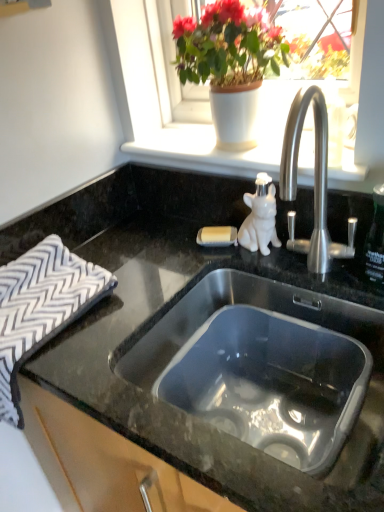
Describe the element at coordinates (172, 306) in the screenshot. I see `black granite countertop at center` at that location.

At what (x,y) coordinates should I click in order to perform the action: click on black granite countertop at center. Please return your answer as a coordinate pair (x, y). This screenshot has width=384, height=512. Looking at the image, I should click on (172, 306).

Find the location of `stainless steel sink at center`. stainless steel sink at center is located at coordinates (261, 362).

What are the coordinates of `white matte window sill at upper center` in the screenshot? It's located at (204, 152).

Considering the points (30, 268) and (269, 290), which point is behind, point (30, 268) or point (269, 290)?

The point (269, 290) is more distant.

From the image's perspective, would you say white zigzag-patterned cloth at left is shown under stainless steel sink at center?

No.

From a real-world perspective, which object rests below the other?

stainless steel sink at center is physically lower.

Which of these two, white zigzag-patterned cloth at left or black granite countertop at center, is bigger?

black granite countertop at center is bigger.

Is white zigzag-patterned cloth at left to the right of black granite countertop at center from the viewer's perspective?

No, white zigzag-patterned cloth at left is not to the right of black granite countertop at center.

Is there a large distance between matte white pot at upper center and stainless steel sink at center?

No.

Who is more distant, matte white pot at upper center or stainless steel sink at center?

matte white pot at upper center is more distant.

From the image's perspective, which is below, matte white pot at upper center or stainless steel sink at center?

stainless steel sink at center is shown below in the image.

Would you say stainless steel sink at center is part of matte white pot at upper center's contents?

→ No, matte white pot at upper center does not contain stainless steel sink at center.

From the picture: Is stainless steel sink at center oriented towards white matte window sill at upper center?

No, stainless steel sink at center is not facing towards white matte window sill at upper center.

Can you confirm if stainless steel sink at center is smaller than white matte window sill at upper center?

Actually, stainless steel sink at center might be larger than white matte window sill at upper center.

Is stainless steel sink at center positioned in front of white matte window sill at upper center?

Yes, stainless steel sink at center is closer to the viewer.

Where is `sink below the white matte window sill at upper center (from a real-world perspective)`? The image size is (384, 512). sink below the white matte window sill at upper center (from a real-world perspective) is located at coordinates (261, 362).

Considering the relative sizes of white matte window sill at upper center and black granite countertop at center in the image provided, is white matte window sill at upper center bigger than black granite countertop at center?

No.

Which object is positioned more to the right, white matte window sill at upper center or black granite countertop at center?

From the viewer's perspective, white matte window sill at upper center appears more on the right side.

Does white matte window sill at upper center come in front of black granite countertop at center?

That is False.

Looking at this image, is stainless steel sink at center thinner than matte white pot at upper center?

No, stainless steel sink at center is not thinner than matte white pot at upper center.

Consider the image. From the image's perspective, does stainless steel sink at center appear higher than matte white pot at upper center?

No, from the image's perspective, stainless steel sink at center is not over matte white pot at upper center.

Considering the sizes of objects stainless steel sink at center and matte white pot at upper center in the image provided, who is taller, stainless steel sink at center or matte white pot at upper center?

matte white pot at upper center.

Is the depth of black granite countertop at center less than that of matte white pot at upper center?

Yes, it is.

Is black granite countertop at center looking in the opposite direction of matte white pot at upper center?

No, black granite countertop at center's orientation is not away from matte white pot at upper center.

Is point (213, 443) closer or farther from the camera than point (176, 58)?

Point (213, 443) is closer to the camera than point (176, 58).

Is the surface of black granite countertop at center in direct contact with matte white pot at upper center?

They are not placed beside each other.

Where is `sink below the white zigzag-patterned cloth at left (from the image's perspective)`? Image resolution: width=384 pixels, height=512 pixels. sink below the white zigzag-patterned cloth at left (from the image's perspective) is located at coordinates (261, 362).

The height and width of the screenshot is (512, 384). Identify the location of bath towel above the black granite countertop at center (from a real-world perspective). coord(41,308).

Estimate the real-world distances between objects in this image. Which object is closer to black granite countertop at center, white matte window sill at upper center or stainless steel sink at center?

stainless steel sink at center is closer to black granite countertop at center.

When comparing their distances from black granite countertop at center, does white matte window sill at upper center or matte white pot at upper center seem further?

Among the two, matte white pot at upper center is located further to black granite countertop at center.

Considering their positions, is black granite countertop at center positioned further to stainless steel sink at center than white matte window sill at upper center?

white matte window sill at upper center.

Looking at the image, which one is located closer to black granite countertop at center, matte white pot at upper center or white matte window sill at upper center?

white matte window sill at upper center.

Estimate the real-world distances between objects in this image. Which object is closer to white zigzag-patterned cloth at left, matte white pot at upper center or white matte window sill at upper center?

Among the two, white matte window sill at upper center is located nearer to white zigzag-patterned cloth at left.

Considering their positions, is matte white pot at upper center positioned further to white matte window sill at upper center than white zigzag-patterned cloth at left?

white zigzag-patterned cloth at left.

Which object lies nearer to the anchor point matte white pot at upper center, stainless steel sink at center or black granite countertop at center?

black granite countertop at center is closer to matte white pot at upper center.

When comparing their distances from black granite countertop at center, does white zigzag-patterned cloth at left or white matte window sill at upper center seem further?

The object further to black granite countertop at center is white matte window sill at upper center.

Locate an element on the screen. bath towel that lies between matte white pot at upper center and black granite countertop at center from top to bottom is located at coordinates (41, 308).

Find the location of `bath towel that lies between white matte window sill at upper center and black granite countertop at center from top to bottom`. bath towel that lies between white matte window sill at upper center and black granite countertop at center from top to bottom is located at coordinates (41, 308).

The width and height of the screenshot is (384, 512). I want to click on window sill between matte white pot at upper center and stainless steel sink at center in the vertical direction, so click(204, 152).

Where is `window sill that lies between matte white pot at upper center and black granite countertop at center from top to bottom`? This screenshot has height=512, width=384. window sill that lies between matte white pot at upper center and black granite countertop at center from top to bottom is located at coordinates (204, 152).